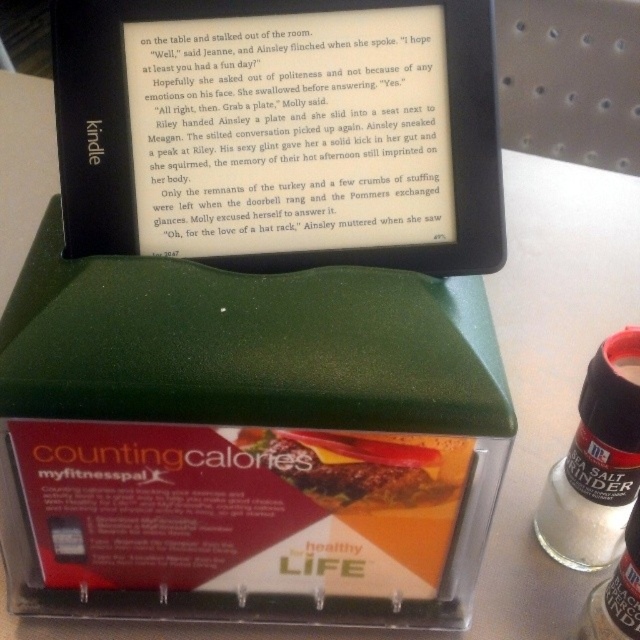
Question: Is white plastic salt grinder at right below golden crispy chicken at center?

Choices:
 (A) no
 (B) yes

Answer: (A)

Question: In this image, where is white plastic salt grinder at right located relative to golden crispy chicken at center?

Choices:
 (A) above
 (B) below

Answer: (A)

Question: Is white plastic salt grinder at right thinner than golden crispy chicken at center?

Choices:
 (A) yes
 (B) no

Answer: (A)

Question: Among these objects, which one is nearest to the camera?

Choices:
 (A) golden crispy chicken at center
 (B) white plastic salt grinder at right

Answer: (A)